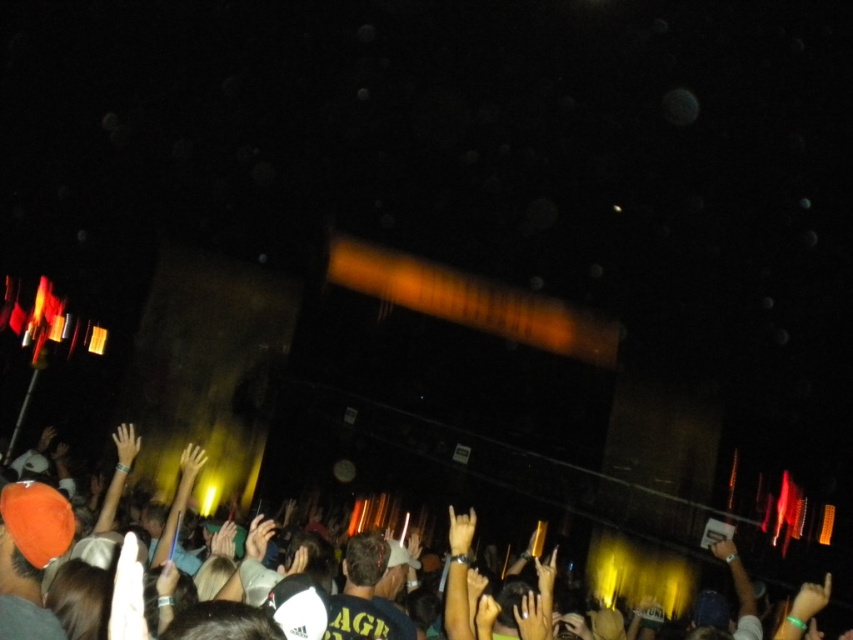
Which is above, orange fabric hat at lower left or light brown leather hand at center?

light brown leather hand at center

This screenshot has height=640, width=853. What are the coordinates of `orange fabric hat at lower left` in the screenshot? It's located at (643, 572).

Identify the location of orange fabric hat at lower left. This screenshot has width=853, height=640. (643, 572).